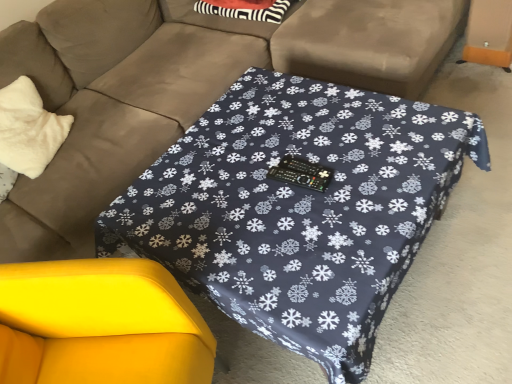
Question: Is matte brown couch at center taller than white fluffy pillow at left?

Choices:
 (A) no
 (B) yes

Answer: (B)

Question: Is matte brown couch at center shorter than white fluffy pillow at left?

Choices:
 (A) yes
 (B) no

Answer: (B)

Question: Can you confirm if matte brown couch at center is smaller than white fluffy pillow at left?

Choices:
 (A) yes
 (B) no

Answer: (B)

Question: Does matte brown couch at center have a greater width compared to white fluffy pillow at left?

Choices:
 (A) yes
 (B) no

Answer: (A)

Question: Is matte brown couch at center next to white fluffy pillow at left?

Choices:
 (A) yes
 (B) no

Answer: (B)

Question: From a real-world perspective, is yellow fabric swivel chair at lower left above or below matte brown couch at center?

Choices:
 (A) below
 (B) above

Answer: (A)

Question: Considering the positions of yellow fabric swivel chair at lower left and matte brown couch at center in the image, is yellow fabric swivel chair at lower left wider or thinner than matte brown couch at center?

Choices:
 (A) wide
 (B) thin

Answer: (B)

Question: From their relative heights in the image, would you say yellow fabric swivel chair at lower left is taller or shorter than matte brown couch at center?

Choices:
 (A) short
 (B) tall

Answer: (A)

Question: In the image, is yellow fabric swivel chair at lower left positioned in front of or behind matte brown couch at center?

Choices:
 (A) front
 (B) behind

Answer: (B)

Question: Considering the positions of point (4, 57) and point (27, 99), is point (4, 57) closer or farther from the camera than point (27, 99)?

Choices:
 (A) closer
 (B) farther

Answer: (A)

Question: From the image's perspective, is matte brown couch at center located above or below white fluffy pillow at left?

Choices:
 (A) below
 (B) above

Answer: (B)

Question: Is matte brown couch at center taller or shorter than white fluffy pillow at left?

Choices:
 (A) tall
 (B) short

Answer: (A)

Question: Is matte brown couch at center bigger or smaller than white fluffy pillow at left?

Choices:
 (A) small
 (B) big

Answer: (B)

Question: Is dark blue fabric table at center inside the boundaries of yellow fabric swivel chair at lower left, or outside?

Choices:
 (A) outside
 (B) inside

Answer: (A)

Question: From a real-world perspective, is dark blue fabric table at center physically located above or below yellow fabric swivel chair at lower left?

Choices:
 (A) below
 (B) above

Answer: (A)